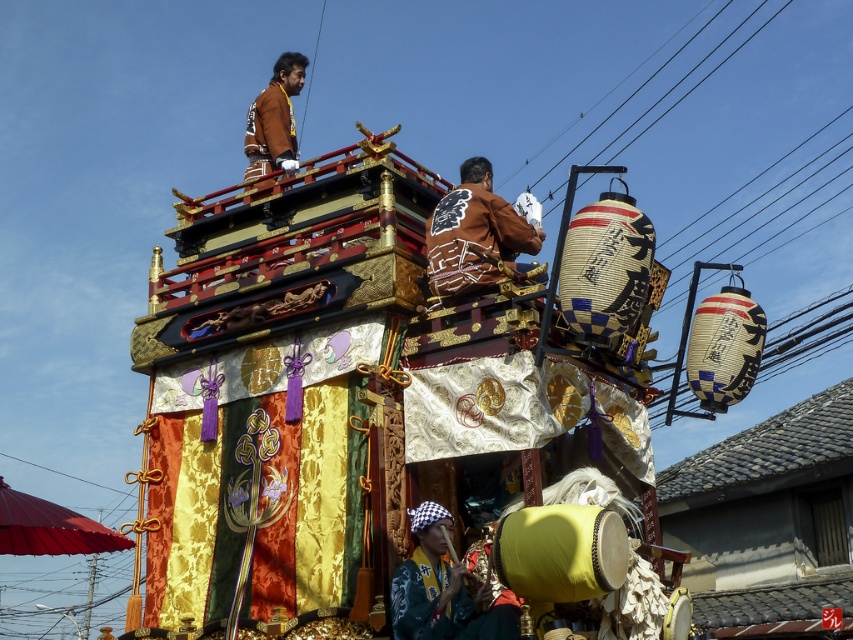
Question: Which point is closer to the camera?

Choices:
 (A) brown leather jacket at upper center
 (B) brown leather jacket at center
 (C) black wire at upper center

Answer: (B)

Question: Among these objects, which one is nearest to the camera?

Choices:
 (A) brown leather jacket at center
 (B) black wire at upper center
 (C) brown leather jacket at upper center

Answer: (A)

Question: From the image, what is the correct spatial relationship of silk fabric headscarf at lower center in relation to black wire at upper center?

Choices:
 (A) left
 (B) right

Answer: (A)

Question: Which point is closer to the camera?

Choices:
 (A) black wire at upper center
 (B) brown leather jacket at center

Answer: (B)

Question: Can you confirm if brown leather jacket at center is positioned to the right of brown leather jacket at upper center?

Choices:
 (A) yes
 (B) no

Answer: (A)

Question: Is brown leather jacket at center behind black wire at upper center?

Choices:
 (A) yes
 (B) no

Answer: (B)